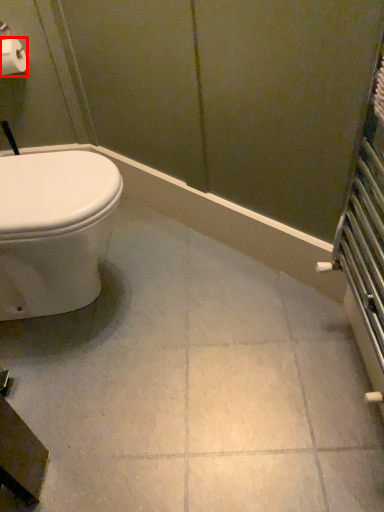
Question: In this image, where is toilet paper (annotated by the red box) located relative to ceramic tile?

Choices:
 (A) right
 (B) left

Answer: (B)